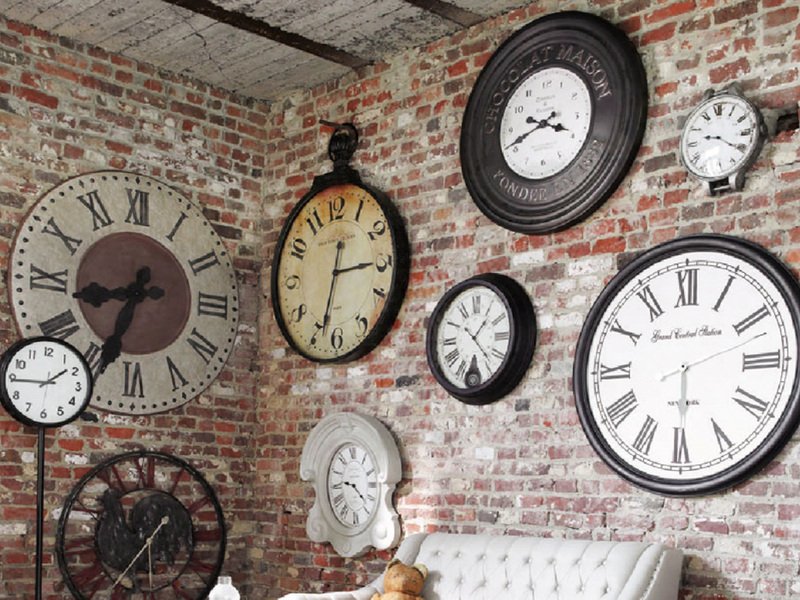
Where is `clocks`? This screenshot has width=800, height=600. clocks is located at coordinates (725, 442), (357, 480), (137, 531), (44, 376), (130, 321), (329, 264), (478, 334), (522, 117), (730, 139).